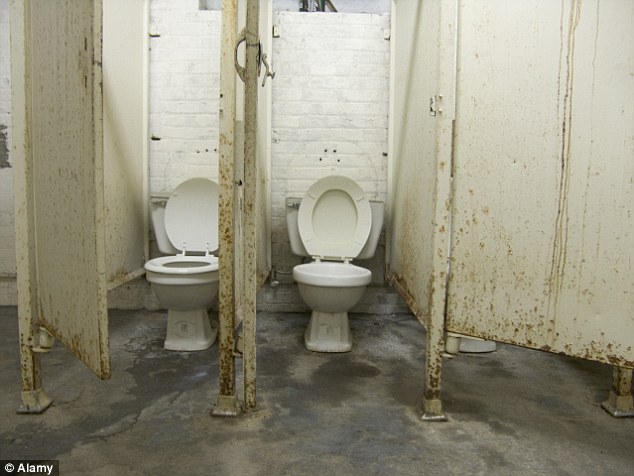
Where is `bathroom floor`? bathroom floor is located at coordinates (132, 430).